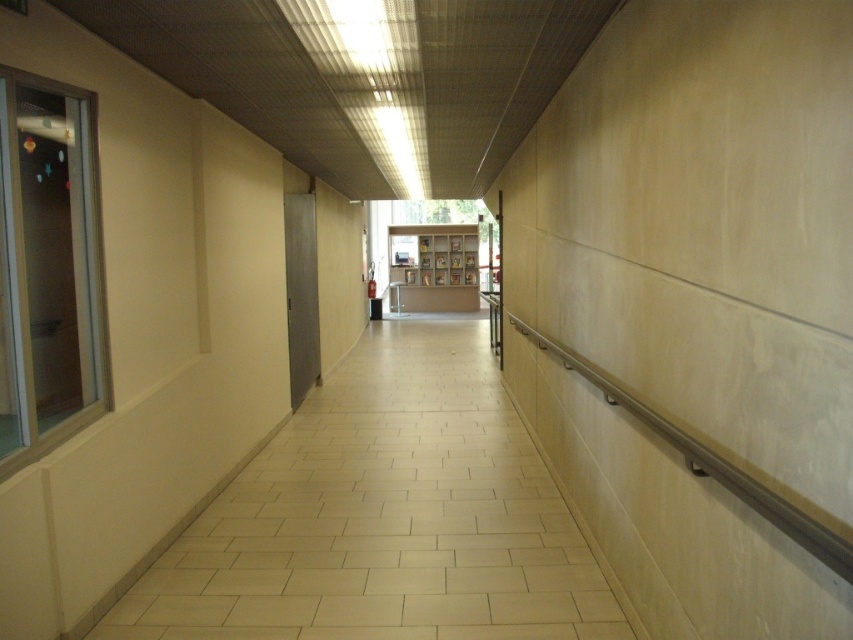
You are standing at the entrance of the corridor and want to walk to the white tile floor at center located at point (384, 516). Which direction should you go?

The white tile floor at center is located at point (384, 516), so you should walk forward along the corridor towards the center to reach it.

You are a maintenance worker needing to place a 1.2 meter tall ladder against the wall. You see the white tile floor at center and the white matte bookshelf at center. Which object should you place the ladder next to for stability?

The white matte bookshelf at center has a greater height than the white tile floor at center, so placing the ladder next to the white matte bookshelf at center would provide better stability due to its taller structure.

You are a delivery person carrying a large box that is 1.5 meters long. You need to navigate through the corridor shown in the image. Can you move the box through the space between the white tile floor at center and the white matte bookshelf at center?

The distance between the white tile floor at center and the white matte bookshelf at center is 13.10 meters, which is more than enough space to move a box that is 1.5 meters long. Yes, you can move the box through the space between them.